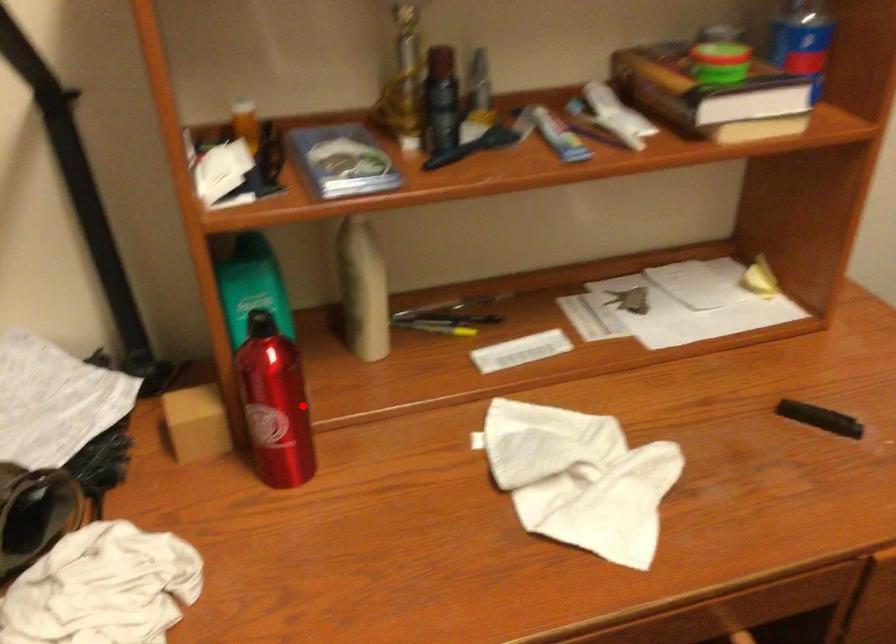
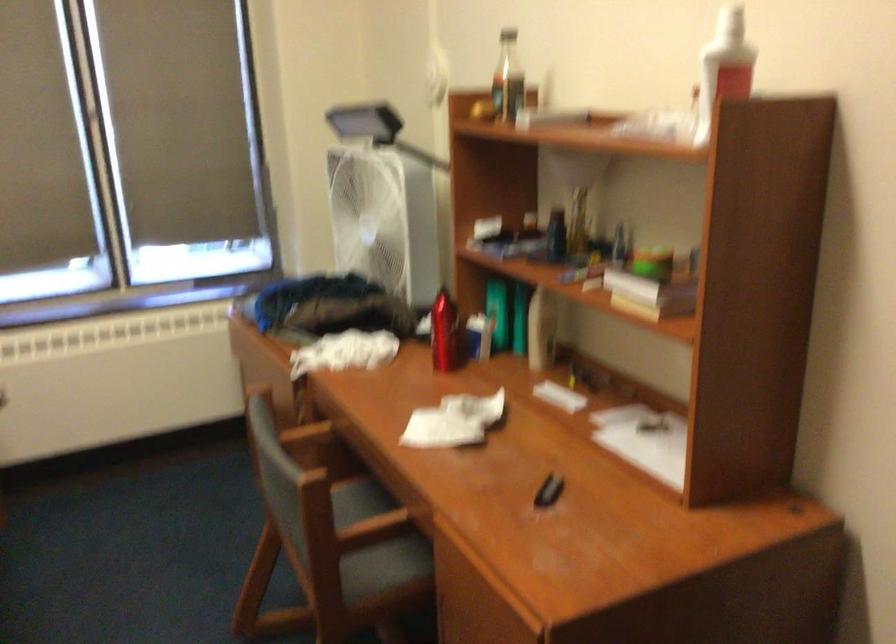
Where in the second image is the point corresponding to the highlighted location from the first image?

(444, 333)